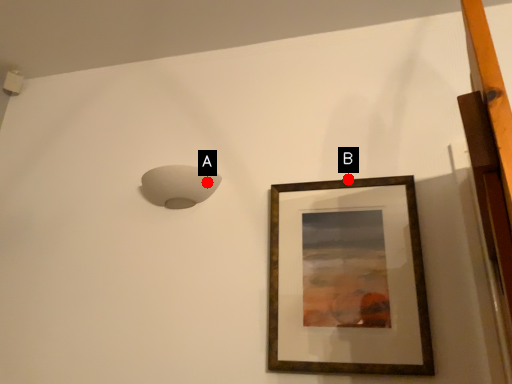
Question: Two points are circled on the image, labeled by A and B beside each circle. Which point is farther from the camera taking this photo?

Choices:
 (A) A is further
 (B) B is further

Answer: (A)